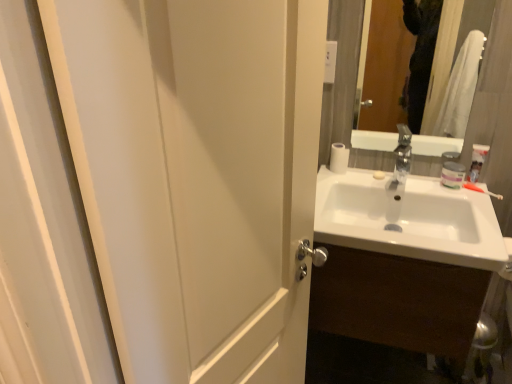
The image size is (512, 384). I want to click on orange plastic toothbrush at right, so click(480, 190).

This screenshot has height=384, width=512. What do you see at coordinates (409, 220) in the screenshot?
I see `white glossy sink at right` at bounding box center [409, 220].

Find the location of a particular element. The height and width of the screenshot is (384, 512). glossy glass mirror at upper right is located at coordinates (446, 93).

Based on the photo, in order to face glossy glass mirror at upper right, should I rotate leftwards or rightwards?

To face it directly, rotate right by 20.880 degrees.

The image size is (512, 384). I want to click on white matte jar at upper right, so click(452, 175).

What is the approximate width of white glossy sink at right?

It is 19.78 inches.

Describe the element at coordinates (477, 161) in the screenshot. I see `white glossy toothpaste at upper right` at that location.

Find the location of a particular element. The height and width of the screenshot is (384, 512). white matte toilet paper at upper right is located at coordinates (339, 158).

Locate an element on the screen. This screenshot has width=512, height=384. orange plastic toothbrush at right is located at coordinates (480, 190).

Does white glossy toothpaste at upper right have a lesser width compared to white matte toilet paper at upper right?

Correct, the width of white glossy toothpaste at upper right is less than that of white matte toilet paper at upper right.

Who is bigger, white glossy toothpaste at upper right or white matte toilet paper at upper right?

With larger size is white matte toilet paper at upper right.

Considering the relative sizes of white glossy toothpaste at upper right and white matte toilet paper at upper right in the image provided, is white glossy toothpaste at upper right shorter than white matte toilet paper at upper right?

In fact, white glossy toothpaste at upper right may be taller than white matte toilet paper at upper right.

From a real-world perspective, is white glossy toothpaste at upper right under white matte toilet paper at upper right?

No, from a real-world perspective, white glossy toothpaste at upper right is not under white matte toilet paper at upper right.

From a real-world perspective, who is located higher, white glossy toothpaste at upper right or white matte jar at upper right?

In real-world perspective, white glossy toothpaste at upper right is above.

Based on the photo, considering the relative sizes of white glossy toothpaste at upper right and white matte jar at upper right in the image provided, is white glossy toothpaste at upper right bigger than white matte jar at upper right?

Correct, white glossy toothpaste at upper right is larger in size than white matte jar at upper right.

Does point (476, 168) appear closer or farther from the camera than point (442, 176)?

Point (476, 168) is positioned closer to the camera compared to point (442, 176).

How many degrees apart are the facing directions of white glossy toothpaste at upper right and white matte jar at upper right?

They differ by 5.64 degrees in their facing directions.

Considering the sizes of objects white glossy sink at right and glossy glass mirror at upper right in the image provided, who is smaller, white glossy sink at right or glossy glass mirror at upper right?

glossy glass mirror at upper right is smaller.

From a real-world perspective, is white glossy sink at right under glossy glass mirror at upper right?

Yes, from a real-world perspective, white glossy sink at right is beneath glossy glass mirror at upper right.

In the image, there is a glossy glass mirror at upper right. Where is `sink below it (from the image's perspective)`? sink below it (from the image's perspective) is located at coordinates click(409, 220).

Is white glossy sink at right surrounding glossy glass mirror at upper right?

Actually, glossy glass mirror at upper right is outside white glossy sink at right.

Between point (469, 186) and point (147, 213), which one is positioned behind?

The point (469, 186) is farther.

Is orange plastic toothbrush at right inside the boundaries of white matte door at left, or outside?

orange plastic toothbrush at right is located beyond the bounds of white matte door at left.

Is orange plastic toothbrush at right far from white matte door at left?

orange plastic toothbrush at right is far away from white matte door at left.

Can you confirm if orange plastic toothbrush at right is wider than white matte door at left?

In fact, orange plastic toothbrush at right might be narrower than white matte door at left.

Does orange plastic toothbrush at right have a lesser width compared to white matte toilet paper at upper right?

Indeed, orange plastic toothbrush at right has a lesser width compared to white matte toilet paper at upper right.

From the image's perspective, who appears lower, orange plastic toothbrush at right or white matte toilet paper at upper right?

orange plastic toothbrush at right appears lower in the image.

In the scene shown: Is orange plastic toothbrush at right positioned far away from white matte toilet paper at upper right?

No, orange plastic toothbrush at right is not far from white matte toilet paper at upper right.

Would you say orange plastic toothbrush at right is inside or outside white matte toilet paper at upper right?

orange plastic toothbrush at right cannot be found inside white matte toilet paper at upper right.

Which object is further away from the camera, white matte door at left or white matte jar at upper right?

Answer: white matte jar at upper right is further from the camera.

Considering the relative sizes of white matte door at left and white matte jar at upper right in the image provided, is white matte door at left smaller than white matte jar at upper right?

Incorrect, white matte door at left is not smaller in size than white matte jar at upper right.

From the image's perspective, is white matte door at left located above or below white matte jar at upper right?

Based on their image positions, white matte door at left is located beneath white matte jar at upper right.

Measure the distance between white matte door at left and white matte jar at upper right.

They are 3.64 feet apart.

Can you confirm if white matte toilet paper at upper right is taller than white glossy sink at right?

In fact, white matte toilet paper at upper right may be shorter than white glossy sink at right.

What's the angular difference between white matte toilet paper at upper right and white glossy sink at right's facing directions?

They differ by 5.5 degrees in their facing directions.

Would you say white matte toilet paper at upper right is to the left or to the right of white glossy sink at right in the picture?

white matte toilet paper at upper right is to the left of white glossy sink at right.

Identify the location of toilet paper above the white glossy toothpaste at upper right (from the image's perspective). (339, 158).

The image size is (512, 384). I want to click on toiletry that appears behind the white glossy toothpaste at upper right, so click(x=452, y=175).

Which object lies further to the anchor point white matte toilet paper at upper right, white glossy sink at right or white matte door at left?

Based on the image, white matte door at left appears to be further to white matte toilet paper at upper right.

Considering their positions, is white matte toilet paper at upper right positioned closer to white matte door at left than white glossy sink at right?

white glossy sink at right is closer to white matte door at left.

Estimate the real-world distances between objects in this image. Which object is closer to white matte jar at upper right, white glossy sink at right or orange plastic toothbrush at right?

Based on the image, orange plastic toothbrush at right appears to be nearer to white matte jar at upper right.

From the image, which object appears to be nearer to white matte jar at upper right, white matte door at left or white glossy sink at right?

white glossy sink at right.

When comparing their distances from glossy glass mirror at upper right, does white glossy toothpaste at upper right or white matte door at left seem further?

white matte door at left.

Looking at the image, which one is located closer to white glossy toothpaste at upper right, orange plastic toothbrush at right or white matte jar at upper right?

white matte jar at upper right is positioned closer to the anchor white glossy toothpaste at upper right.

When comparing their distances from glossy glass mirror at upper right, does white glossy sink at right or white glossy sink at right seem further?

Based on the image, white glossy sink at right appears to be further to glossy glass mirror at upper right.

When comparing their distances from white matte toilet paper at upper right, does white glossy toothpaste at upper right or white glossy sink at right seem further?

white glossy toothpaste at upper right lies further to white matte toilet paper at upper right than the other object.

I want to click on bathroom cabinet positioned between white matte door at left and white glossy toothpaste at upper right from near to far, so click(390, 317).

You are a GUI agent. You are given a task and a screenshot of the screen. Output one action in this format:
    pyautogui.click(x=<x>, y=<y>)
    Task: Click on the sink located between white matte door at left and orange plastic toothbrush at right in the depth direction
    The width and height of the screenshot is (512, 384).
    Given the screenshot: What is the action you would take?
    pyautogui.click(x=409, y=220)

At what (x,y) coordinates should I click in order to perform the action: click on sink between white matte jar at upper right and white glossy sink at right in the up-down direction. Please return your answer as a coordinate pair (x, y). The width and height of the screenshot is (512, 384). Looking at the image, I should click on (409, 220).

Locate an element on the screen. The image size is (512, 384). toothpaste between white matte door at left and white matte jar at upper right along the z-axis is located at coordinates (477, 161).